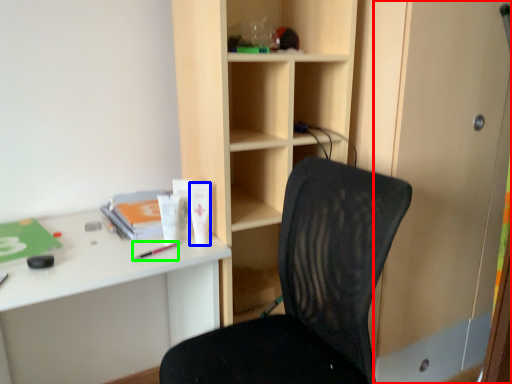
Question: Which object is positioned farthest from screen door (highlighted by a red box)? Select from stationery (highlighted by a blue box) and stationery (highlighted by a green box).

Choices:
 (A) stationery
 (B) stationery

Answer: (B)